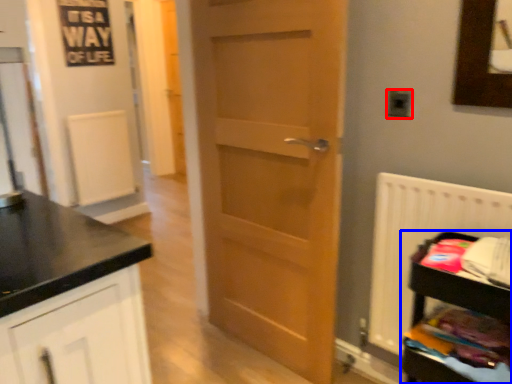
Question: Which object is closer to the camera taking this photo, electric outlet (highlighted by a red box) or shelf (highlighted by a blue box)?

Choices:
 (A) electric outlet
 (B) shelf

Answer: (B)